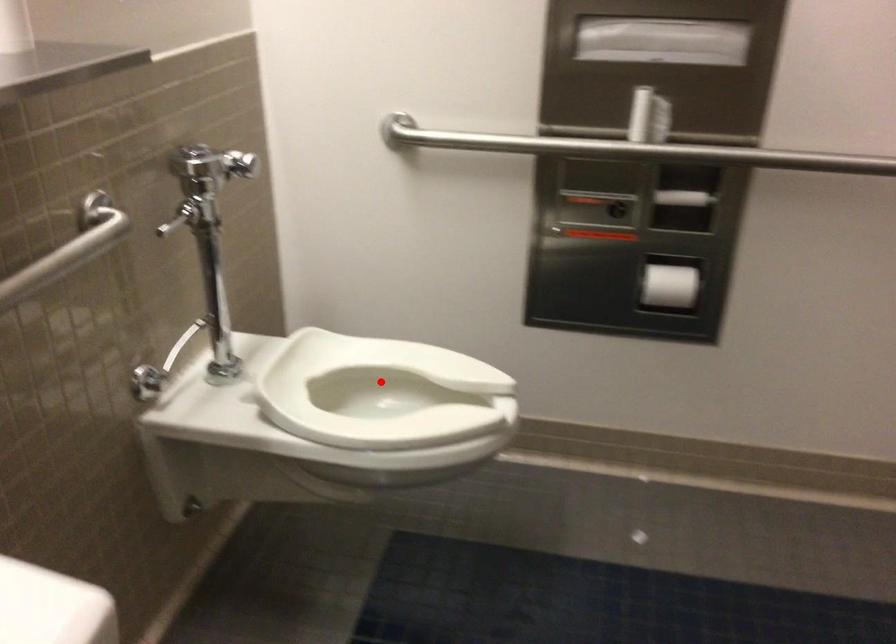
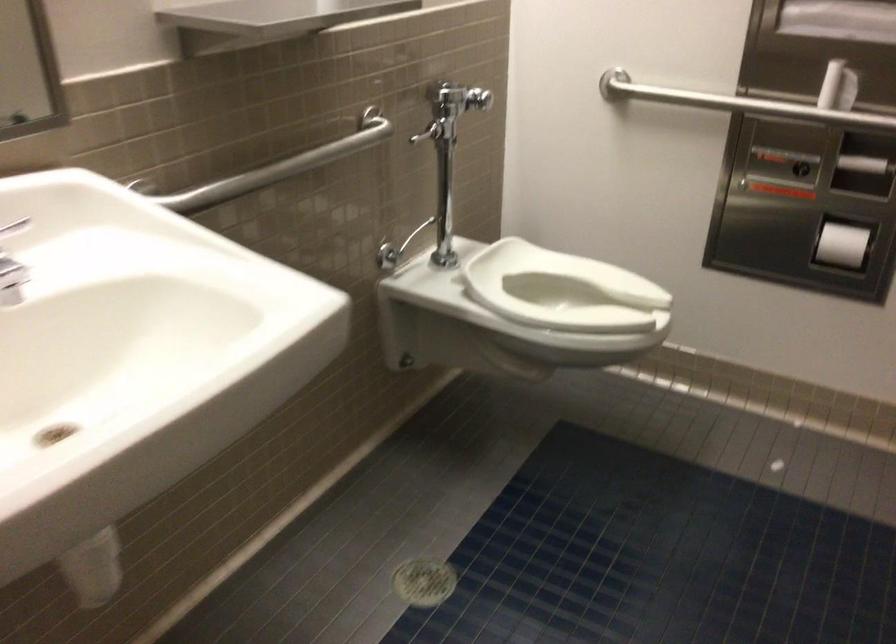
Question: I am providing you with two images of the same scene from different viewpoints. Image1 has a red point marked. In image2, the corresponding 3D location appears at what relative position? Reply with the corresponding letter.

Choices:
 (A) Closer
 (B) Farther

Answer: (B)